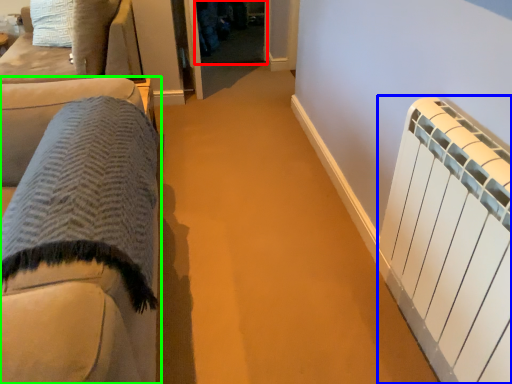
Question: Which is farther away from glass door (highlighted by a red box)? radiator (highlighted by a blue box) or furniture (highlighted by a green box)?

Choices:
 (A) radiator
 (B) furniture

Answer: (A)